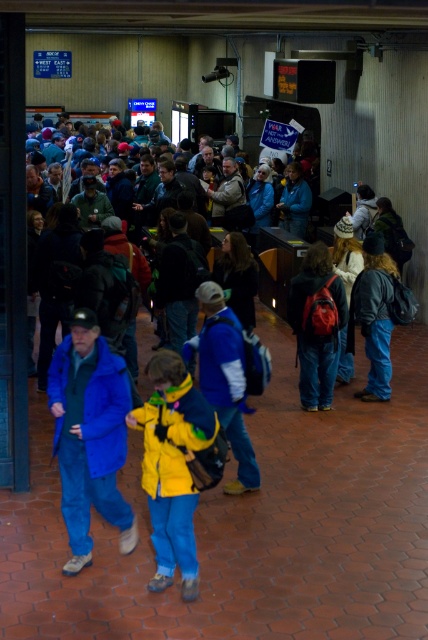
You are a traveler in the train station and you want to reach your destination without bumping into anyone. You see a matte red backpack at center and a denim jacket at right. Which object should you avoid walking into to stay on your path?

You should avoid walking into the matte red backpack at center because it is in front of the denim jacket at right, meaning it is closer to your current position.

You are a traveler in a train station and you want to locate your two items. You have a matte red backpack at center and a denim jacket at right. According to the scene, which item is positioned more to the left?

The matte red backpack at center is positioned more to the left than the denim jacket at right.